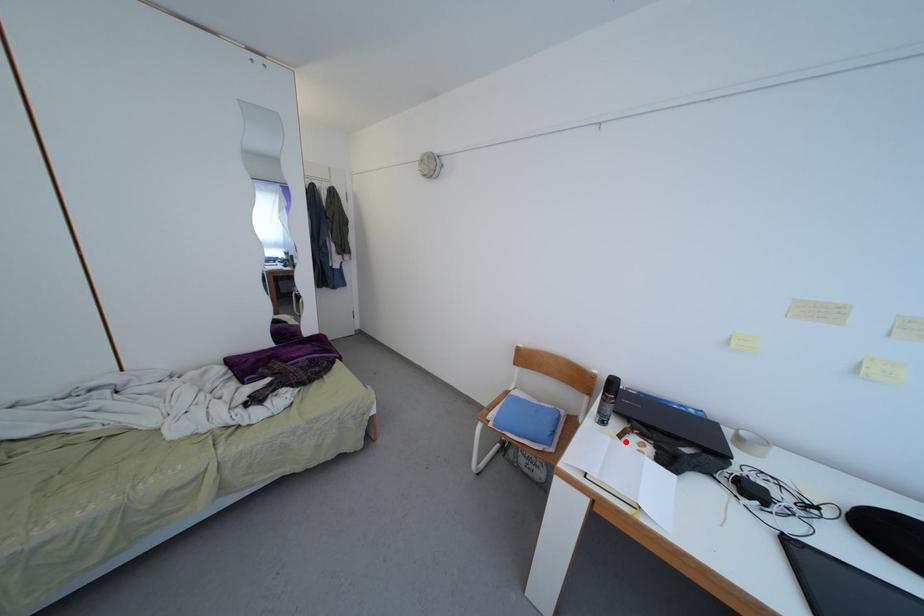
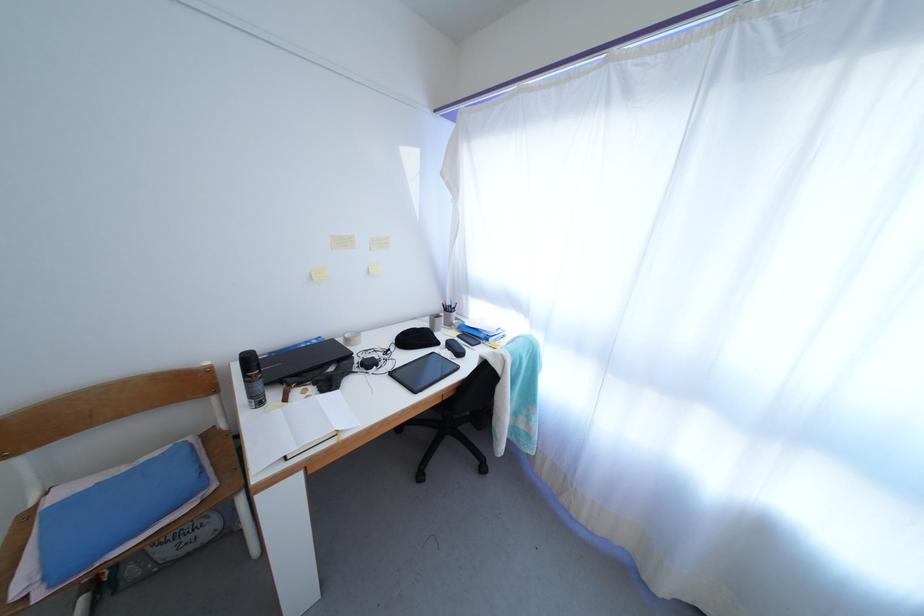
Where in the second image is the point corresponding to the highlighted location from the first image?

(290, 406)